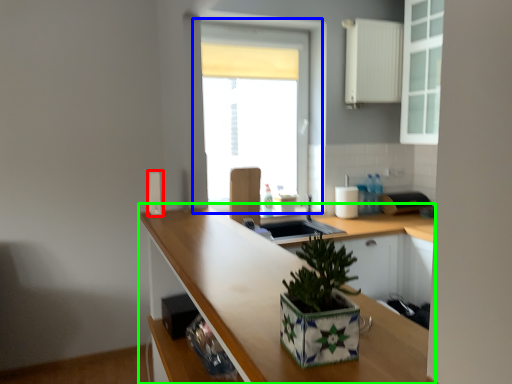
Question: Based on their relative distances, which object is farther from appliance (highlighted by a red box)? Choose from window (highlighted by a blue box) and countertop (highlighted by a green box).

Choices:
 (A) window
 (B) countertop

Answer: (A)